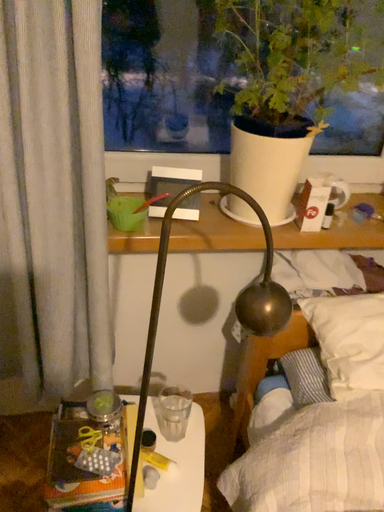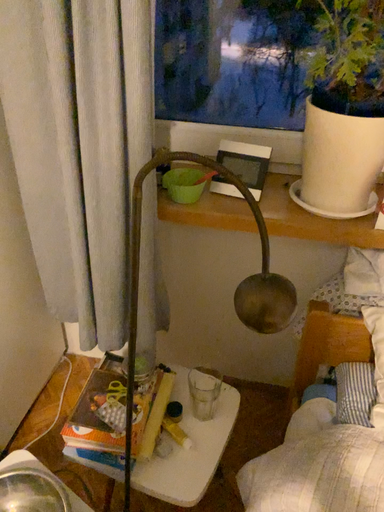
Question: How did the camera likely rotate when shooting the video?

Choices:
 (A) rotated right
 (B) rotated left

Answer: (B)